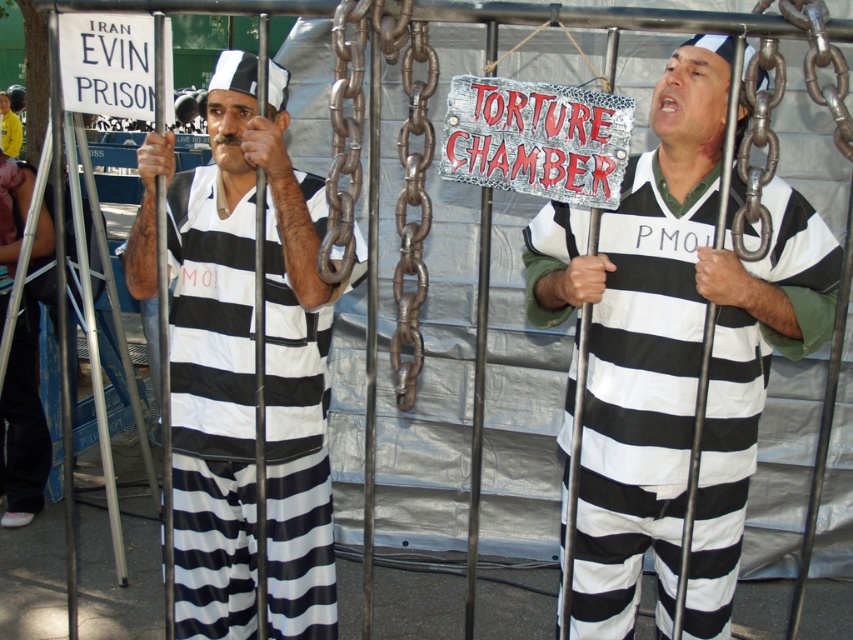
Question: Observing the image, what is the correct spatial positioning of matte black striped jumpsuit at left in reference to rusty metal chain at center?

Choices:
 (A) right
 (B) left

Answer: (B)

Question: From the image, what is the correct spatial relationship of matte black striped jumpsuit at center in relation to matte black striped jumpsuit at left?

Choices:
 (A) right
 (B) left

Answer: (A)

Question: Can you confirm if matte black striped jumpsuit at left is positioned to the left of rusty metal chain at center?

Choices:
 (A) no
 (B) yes

Answer: (B)

Question: Among these objects, which one is farthest from the camera?

Choices:
 (A) matte black striped jumpsuit at left
 (B) matte black striped jumpsuit at center

Answer: (B)

Question: Which of the following is the farthest from the observer?

Choices:
 (A) (624, 392)
 (B) (416, 97)
 (C) (300, 512)

Answer: (C)

Question: Among these points, which one is nearest to the camera?

Choices:
 (A) (193, 241)
 (B) (766, 342)
 (C) (418, 173)

Answer: (C)